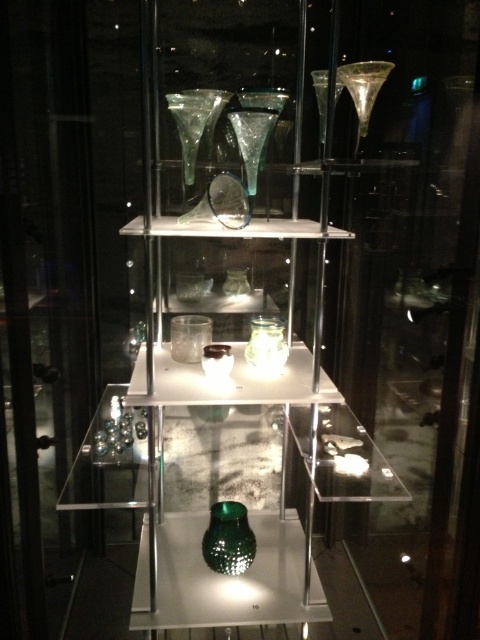
You are looking at the glass display case and notice two points marked in the image. The first point is at coordinates point (192, 141) and the second is at point (282, 358). Which of these points is closer to your viewpoint?

Point (192, 141) is closer to the camera than point (282, 358).

What are the coordinates of the transparent glass vase at upper center in the display case?

The transparent glass vase at upper center is located at point [190,125].

You are a customer in a store and see the green textured glass at center and the translucent glass jar at center inside a display case. Which one is located to the left when viewed from the front?

The green textured glass at center is positioned on the left side of the translucent glass jar at center, so it is located to the left when viewed from the front.